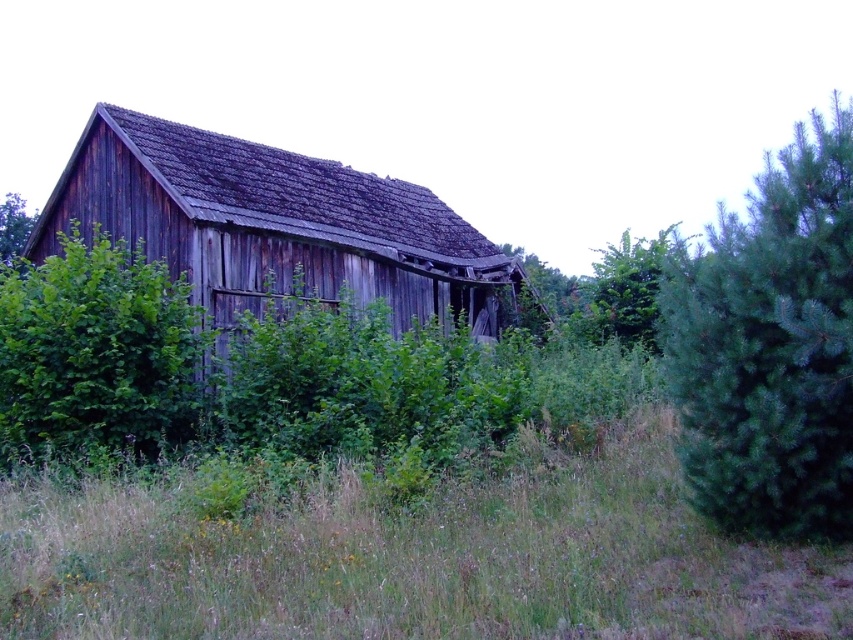
You are an inspector assessing the barn for structural integrity. You notice the weathered wood hut at center and the green leafy bush at left. Which object is taller?

The weathered wood hut at center is taller than the green leafy bush at left according to the description.

You are standing in front of the old wooden barn and notice a point marked at coordinates (416, 561). According to the scene description, what object or feature is located at that point?

The point at coordinates (416, 561) corresponds to the green grass at center.